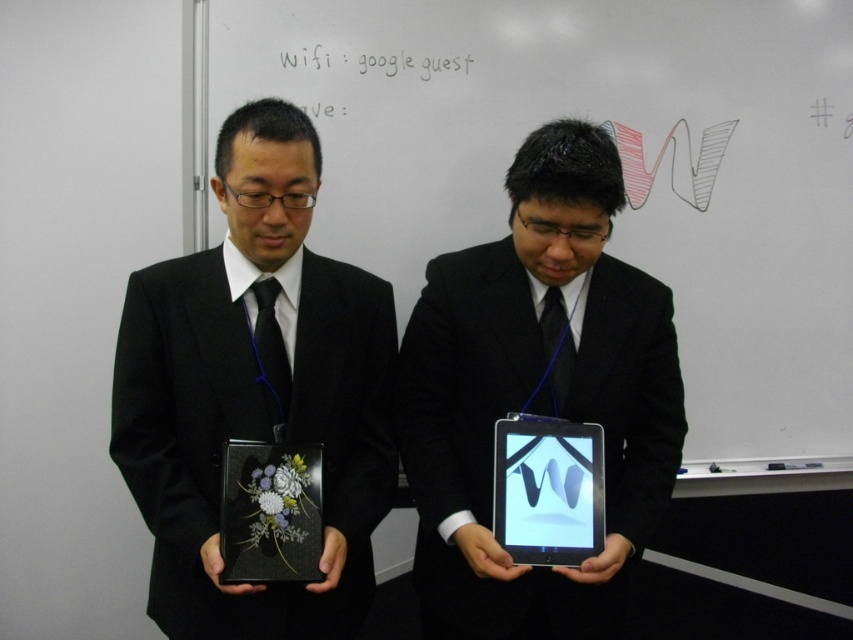
Question: Does matte black tablet at center appear over black glossy plaque at center?

Choices:
 (A) no
 (B) yes

Answer: (B)

Question: Is matte black box at center below matte black tablet at center?

Choices:
 (A) no
 (B) yes

Answer: (A)

Question: Estimate the real-world distances between objects in this image. Which object is closer to the matte black box at center?

Choices:
 (A) shiny black tablet at center
 (B) matte black tablet at center
 (C) black glossy plaque at center

Answer: (C)

Question: Estimate the real-world distances between objects in this image. Which object is closer to the matte black tablet at center?

Choices:
 (A) matte black box at center
 (B) black glossy plaque at center
 (C) shiny black tablet at center

Answer: (C)

Question: Which point is farther from the camera taking this photo?

Choices:
 (A) (596, 588)
 (B) (500, 525)
 (C) (316, 474)
 (D) (119, 333)

Answer: (A)

Question: Does matte black box at center have a greater width compared to shiny black tablet at center?

Choices:
 (A) yes
 (B) no

Answer: (B)